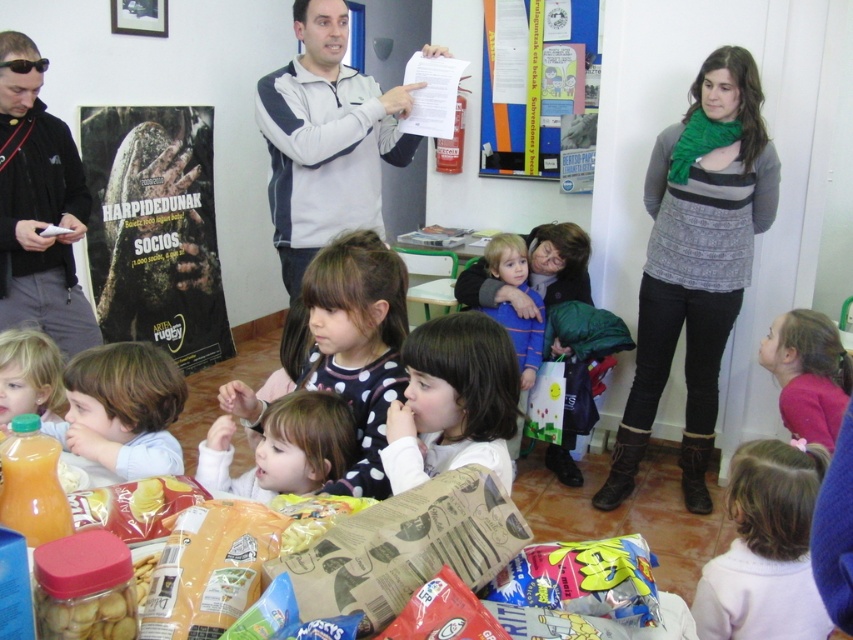
Question: Among these objects, which one is nearest to the camera?

Choices:
 (A) polka dot fabric dress at center
 (B) white dotted shirt at center
 (C) sweatshirt at upper center

Answer: (B)

Question: Which is nearer to the pink knitted sweater at lower right?

Choices:
 (A) pink fabric at upper right
 (B) sweatshirt at upper center

Answer: (A)

Question: Based on their relative distances, which object is farther from the polka dot fabric dress at center?

Choices:
 (A) paperboard poster at upper center
 (B) pink knitted sweater at lower right
 (C) sweatshirt at upper center

Answer: (A)

Question: Does smooth beige shirt at center appear over blue striped sweater at center?

Choices:
 (A) no
 (B) yes

Answer: (A)

Question: Is the position of green knitted scarf at upper right more distant than that of translucent plastic bottle of orange juice at lower left?

Choices:
 (A) yes
 (B) no

Answer: (A)

Question: Is sweatshirt at upper center further to camera compared to black fabric jacket at left?

Choices:
 (A) yes
 (B) no

Answer: (B)